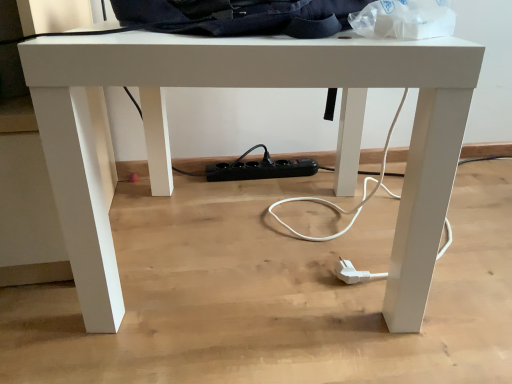
Question: Should I look upward or downward to see dark blue fabric messenger bag at upper center?

Choices:
 (A) up
 (B) down

Answer: (A)

Question: Is transparent plastic bag at upper right next to dark blue fabric messenger bag at upper center and touching it?

Choices:
 (A) no
 (B) yes

Answer: (A)

Question: Considering the relative sizes of transparent plastic bag at upper right and dark blue fabric messenger bag at upper center in the image provided, is transparent plastic bag at upper right shorter than dark blue fabric messenger bag at upper center?

Choices:
 (A) no
 (B) yes

Answer: (A)

Question: Would you say transparent plastic bag at upper right is outside dark blue fabric messenger bag at upper center?

Choices:
 (A) no
 (B) yes

Answer: (A)

Question: From the image's perspective, does transparent plastic bag at upper right appear higher than dark blue fabric messenger bag at upper center?

Choices:
 (A) yes
 (B) no

Answer: (B)

Question: Considering the relative sizes of transparent plastic bag at upper right and dark blue fabric messenger bag at upper center in the image provided, is transparent plastic bag at upper right wider than dark blue fabric messenger bag at upper center?

Choices:
 (A) yes
 (B) no

Answer: (B)

Question: Is transparent plastic bag at upper right at the left side of dark blue fabric messenger bag at upper center?

Choices:
 (A) no
 (B) yes

Answer: (A)

Question: Does dark blue fabric messenger bag at upper center have a greater height compared to transparent plastic bag at upper right?

Choices:
 (A) no
 (B) yes

Answer: (A)

Question: From the image's perspective, is dark blue fabric messenger bag at upper center on transparent plastic bag at upper right?

Choices:
 (A) yes
 (B) no

Answer: (A)

Question: Does dark blue fabric messenger bag at upper center have a lesser width compared to transparent plastic bag at upper right?

Choices:
 (A) no
 (B) yes

Answer: (A)

Question: Does dark blue fabric messenger bag at upper center appear on the left side of transparent plastic bag at upper right?

Choices:
 (A) no
 (B) yes

Answer: (B)

Question: Does dark blue fabric messenger bag at upper center have a lesser height compared to transparent plastic bag at upper right?

Choices:
 (A) no
 (B) yes

Answer: (B)

Question: From a real-world perspective, is dark blue fabric messenger bag at upper center beneath transparent plastic bag at upper right?

Choices:
 (A) yes
 (B) no

Answer: (B)

Question: Considering the positions of dark blue fabric messenger bag at upper center and transparent plastic bag at upper right in the image, is dark blue fabric messenger bag at upper center taller or shorter than transparent plastic bag at upper right?

Choices:
 (A) short
 (B) tall

Answer: (A)